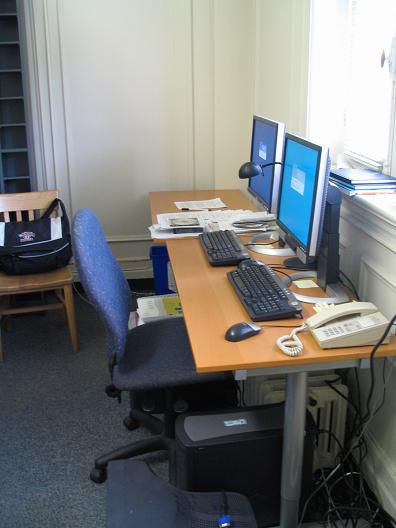
What are the coordinates of `carpet` in the screenshot? It's located at (85, 414).